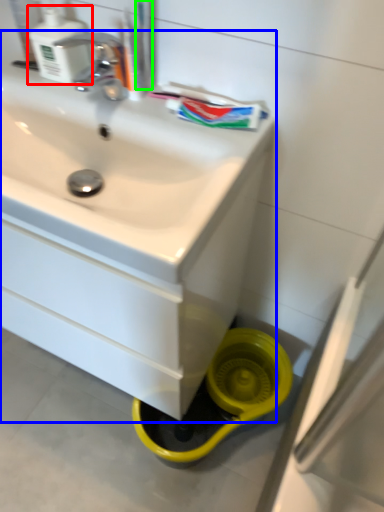
Question: Considering the real-world distances, which object is farthest from soap dispenser (highlighted by a red box)? sink (highlighted by a blue box) or toothbrush (highlighted by a green box)?

Choices:
 (A) sink
 (B) toothbrush

Answer: (A)